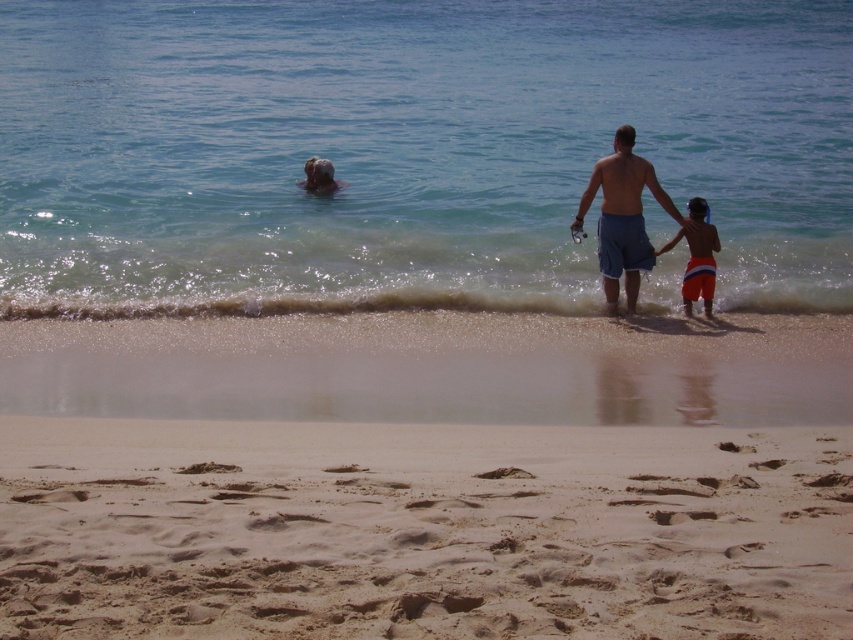
Question: Does fine-grained sand at lower center appear under orange striped shorts at right?

Choices:
 (A) yes
 (B) no

Answer: (A)

Question: Which object appears closest to the camera in this image?

Choices:
 (A) fine-grained sand at lower center
 (B) clear blue water at upper center
 (C) blue denim shorts at center

Answer: (A)

Question: Does clear blue water at upper center have a greater width compared to fine-grained sand at lower center?

Choices:
 (A) no
 (B) yes

Answer: (B)

Question: Which is nearer to the clear blue water at upper center?

Choices:
 (A) fine-grained sand at lower center
 (B) orange striped shorts at right

Answer: (B)

Question: Is clear blue water at upper center bigger than orange striped shorts at right?

Choices:
 (A) yes
 (B) no

Answer: (A)

Question: Which point is closer to the camera?

Choices:
 (A) fine-grained sand at lower center
 (B) orange striped shorts at right
 (C) clear blue water at upper center

Answer: (A)